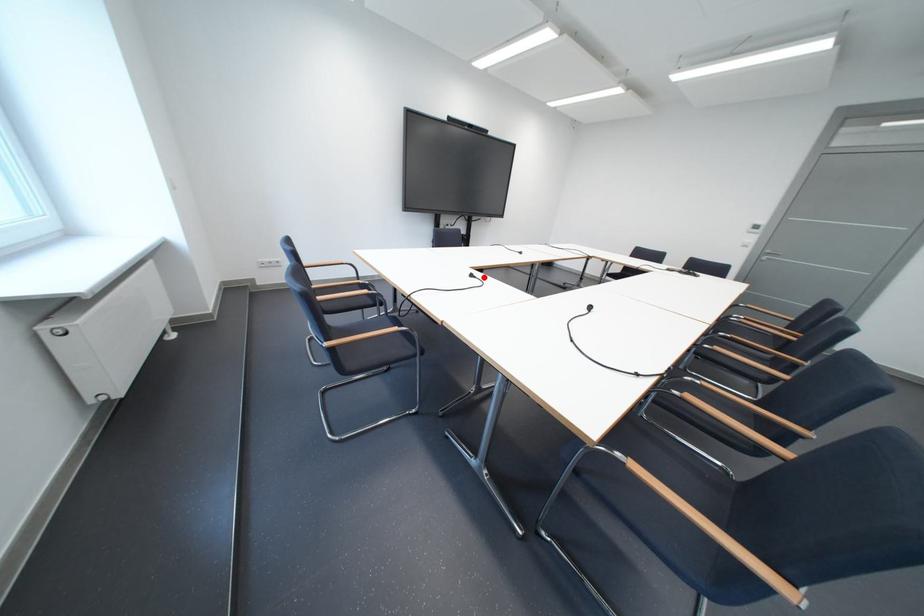
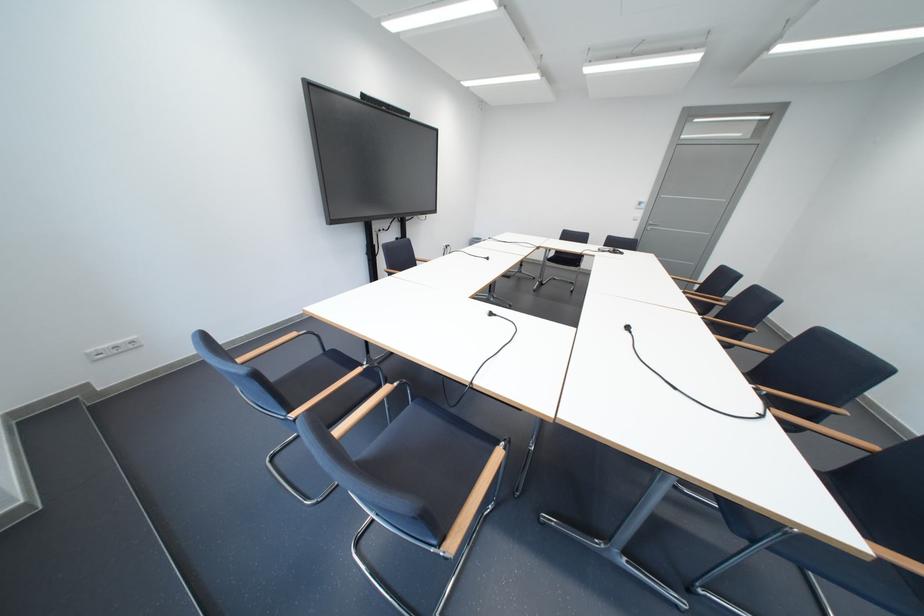
Question: I am providing you with two images of the same scene from different viewpoints. A red point is marked on the first image. Can you still see the location of the red point in image 2?

Choices:
 (A) Yes
 (B) No

Answer: (A)